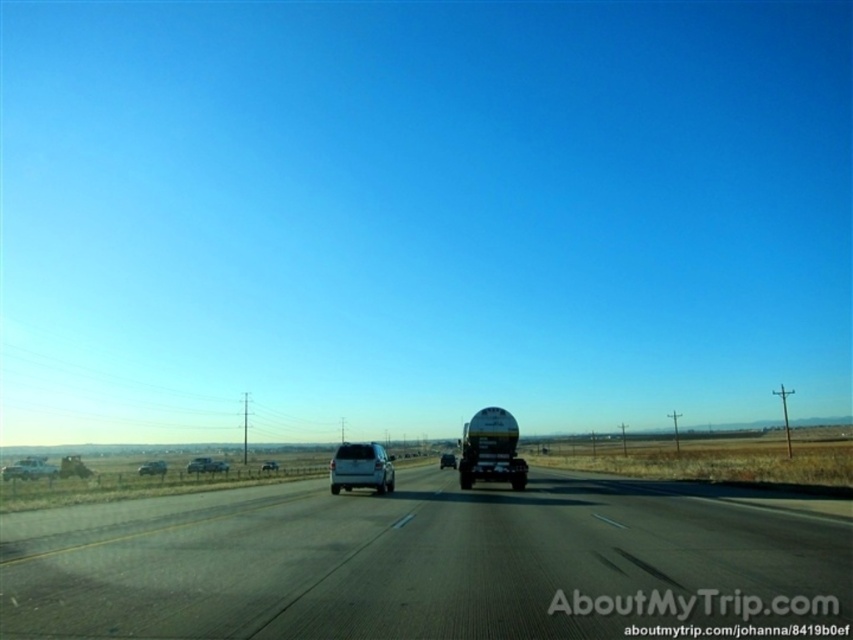
Question: Among these objects, which one is nearest to the camera?

Choices:
 (A) black asphalt highway at center
 (B) satin silver suv at center

Answer: (A)

Question: Which point is farther from the camera taking this photo?

Choices:
 (A) (54, 556)
 (B) (376, 456)
 (C) (495, 468)

Answer: (C)

Question: Where is silver metallic sedan at lower left located in relation to glossy white suv at center in the image?

Choices:
 (A) right
 (B) left

Answer: (B)

Question: Which object is farther from the camera taking this photo?

Choices:
 (A) silver metallic suv at lower left
 (B) silver metallic sedan at lower left
 (C) silver metallic suv at center

Answer: (C)

Question: Does satin silver suv at center have a larger size compared to silver metallic sedan at lower left?

Choices:
 (A) no
 (B) yes

Answer: (B)

Question: Can you confirm if glossy white suv at center is positioned to the left of white matte suv at center?

Choices:
 (A) no
 (B) yes

Answer: (A)